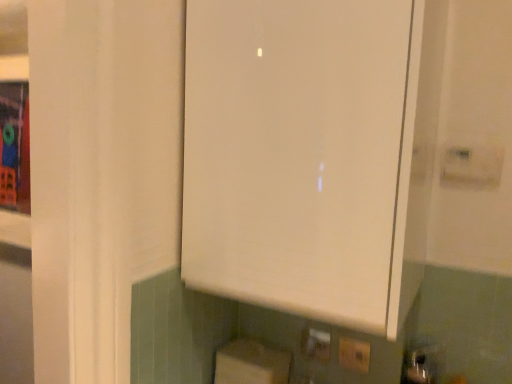
Question: From the image's perspective, does white matte cabinet at center appear lower than white cardboard box at lower center?

Choices:
 (A) yes
 (B) no

Answer: (B)

Question: Is white matte cabinet at center smaller than white cardboard box at lower center?

Choices:
 (A) yes
 (B) no

Answer: (B)

Question: From a real-world perspective, is white matte cabinet at center on white cardboard box at lower center?

Choices:
 (A) yes
 (B) no

Answer: (A)

Question: Can you confirm if white matte cabinet at center is bigger than white cardboard box at lower center?

Choices:
 (A) yes
 (B) no

Answer: (A)

Question: Is white matte cabinet at center far from white cardboard box at lower center?

Choices:
 (A) yes
 (B) no

Answer: (B)

Question: From the image's perspective, is white plastic electric outlet at lower center, marked as the 1th electric outlet in a front-to-back arrangement, above or below white cardboard box at lower center?

Choices:
 (A) below
 (B) above

Answer: (B)

Question: Is white plastic electric outlet at lower center, marked as the 1th electric outlet in a front-to-back arrangement, taller or shorter than white cardboard box at lower center?

Choices:
 (A) short
 (B) tall

Answer: (A)

Question: Considering the positions of white plastic electric outlet at lower center, which is the 2th electric outlet in left-to-right order, and white cardboard box at lower center in the image, is white plastic electric outlet at lower center, which is the 2th electric outlet in left-to-right order, bigger or smaller than white cardboard box at lower center?

Choices:
 (A) small
 (B) big

Answer: (A)

Question: Is white plastic electric outlet at lower center, marked as the 1th electric outlet in a front-to-back arrangement, spatially inside white cardboard box at lower center, or outside of it?

Choices:
 (A) outside
 (B) inside

Answer: (A)

Question: Does point (329, 347) appear closer or farther from the camera than point (356, 354)?

Choices:
 (A) closer
 (B) farther

Answer: (B)

Question: Considering the positions of yellow plastic electric outlet at lower center, placed as the second electric outlet when sorted from front to back, and white plastic electric outlet at lower center, which is counted as the 1th electric outlet, starting from the right, in the image, is yellow plastic electric outlet at lower center, placed as the second electric outlet when sorted from front to back, wider or thinner than white plastic electric outlet at lower center, which is counted as the 1th electric outlet, starting from the right,?

Choices:
 (A) thin
 (B) wide

Answer: (B)

Question: Which is correct: yellow plastic electric outlet at lower center, placed as the first electric outlet when sorted from left to right, is inside white plastic electric outlet at lower center, which is the 2th electric outlet in left-to-right order, or outside of it?

Choices:
 (A) outside
 (B) inside

Answer: (A)

Question: In the image, is yellow plastic electric outlet at lower center, which appears as the first electric outlet when viewed from the back, positioned in front of or behind white plastic electric outlet at lower center, which appears as the 2th electric outlet when viewed from the back?

Choices:
 (A) front
 (B) behind

Answer: (B)

Question: Is yellow plastic electric outlet at lower center, which is the 2th electric outlet from right to left, taller or shorter than white cardboard box at lower center?

Choices:
 (A) tall
 (B) short

Answer: (B)

Question: Considering the relative positions of yellow plastic electric outlet at lower center, placed as the first electric outlet when sorted from left to right, and white cardboard box at lower center in the image provided, is yellow plastic electric outlet at lower center, placed as the first electric outlet when sorted from left to right, to the left or to the right of white cardboard box at lower center?

Choices:
 (A) left
 (B) right

Answer: (B)